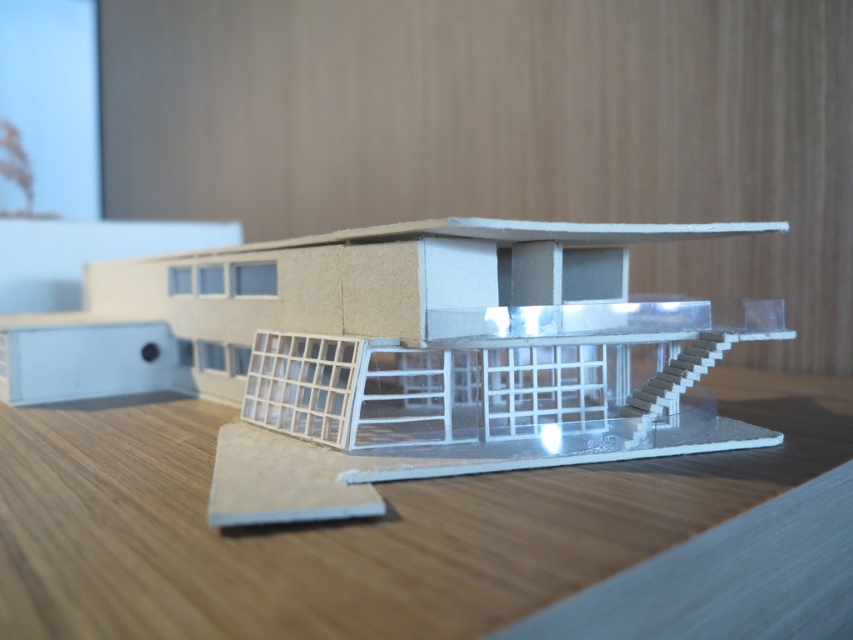
You are an architect examining a model of a modern house. You notice the transparent plastic house at center and the wooden table at center. Which object takes up more space in the scene?

The transparent plastic house at center has a larger size compared to wooden table at center, so it takes up more space in the scene.

You are standing in front of the transparent plastic house at center and want to place a small decorative item on the wooden table at center. Can you directly reach the table without moving the house?

The wooden table at center is behind the transparent plastic house at center, so you cannot directly reach it without moving the house.